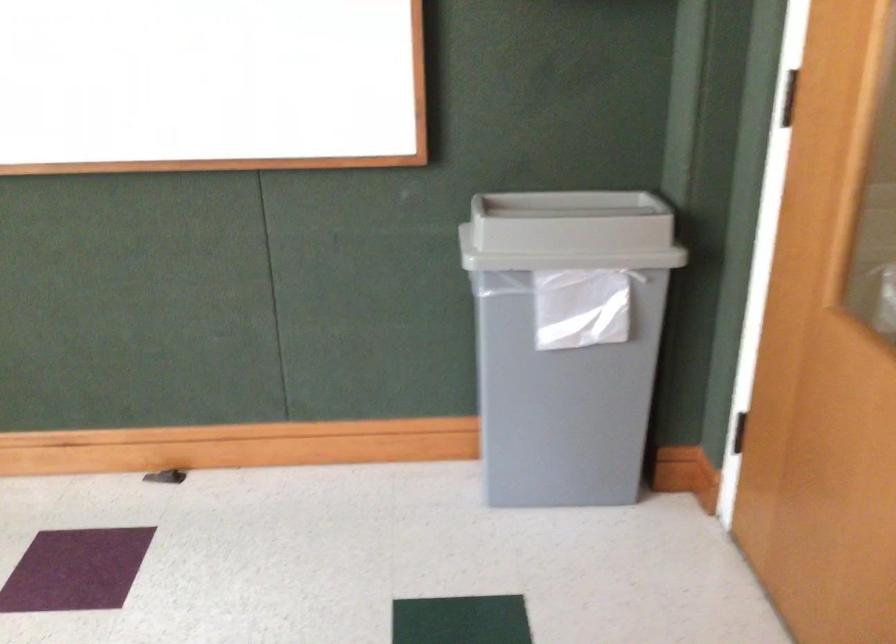
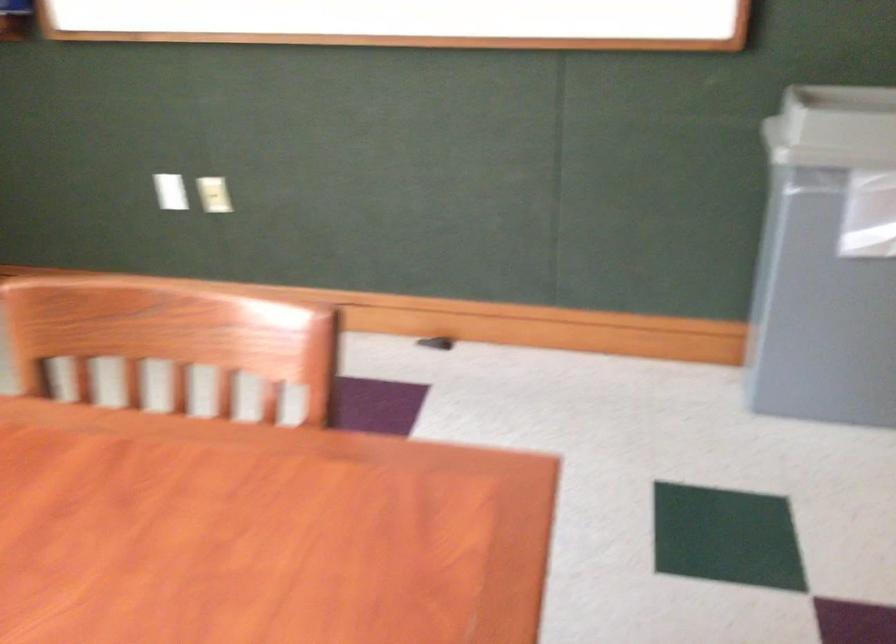
The images are taken continuously from a first-person perspective. In which direction are you moving?

The cameraman moved toward left, backward.